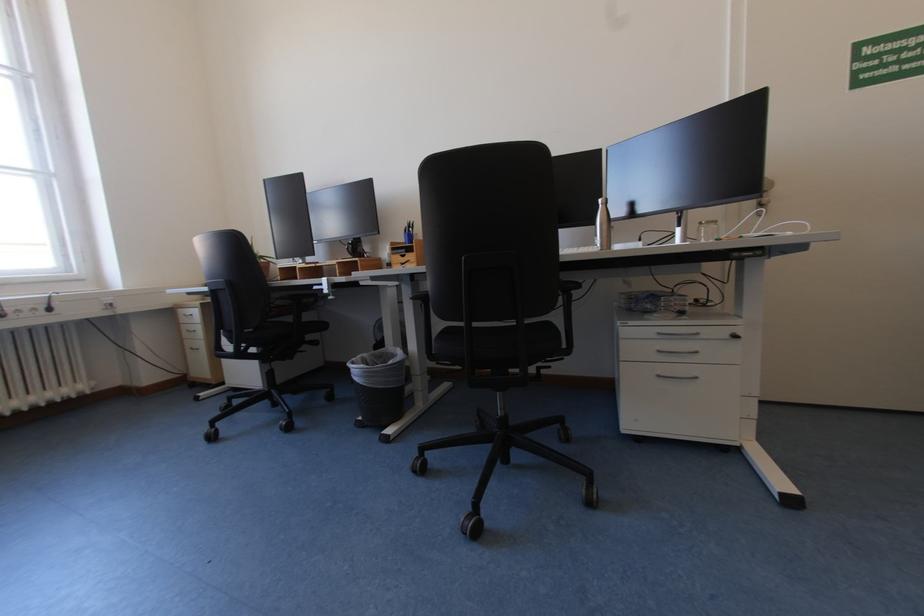
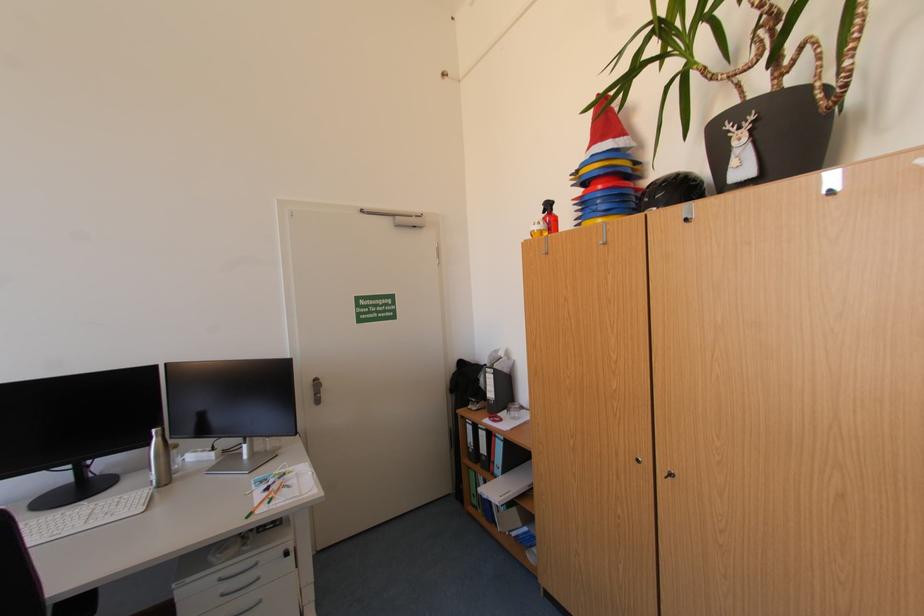
Question: The images are taken continuously from a first-person perspective. In which direction is your viewpoint rotating?

Choices:
 (A) Left
 (B) Right
 (C) Up
 (D) Down

Answer: (B)